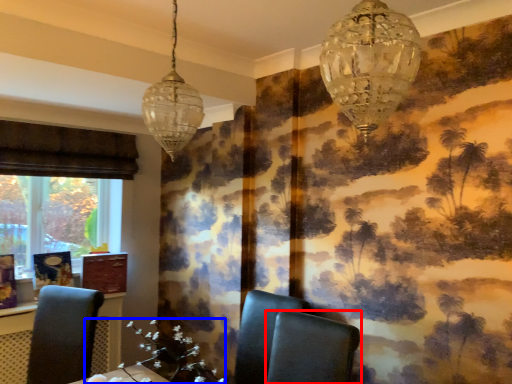
Question: Which point is closer to the camera, chair (highlighted by a red box) or flower (highlighted by a blue box)?

Choices:
 (A) chair
 (B) flower

Answer: (A)